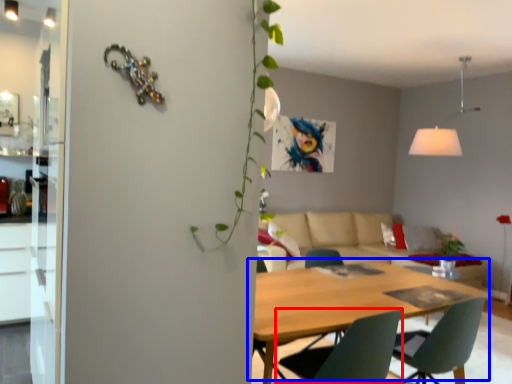
Question: Which object is further to the camera taking this photo, chair (highlighted by a red box) or kitchen & dining room table (highlighted by a blue box)?

Choices:
 (A) chair
 (B) kitchen & dining room table

Answer: (A)